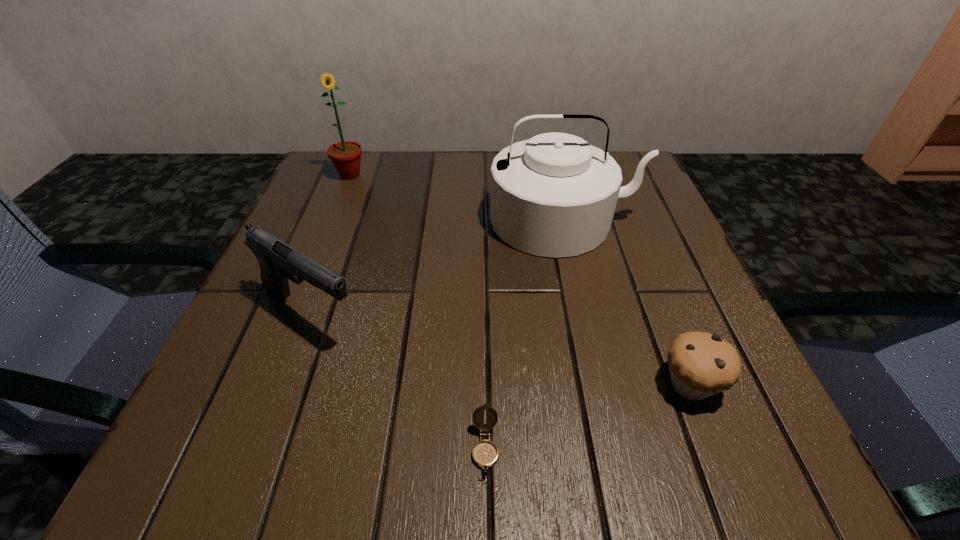
Locate an element on the screen. The image size is (960, 540). vacant space situated 0.170m at the muzzle of the third nearest object is located at coordinates coord(473,314).

Locate an element on the screen. The image size is (960, 540). vacant region located 0.150m on the left of the muffin is located at coordinates (553, 384).

You are a GUI agent. You are given a task and a screenshot of the screen. Output one action in this format:
    pyautogui.click(x=<x>, y=<y>)
    Task: Click on the sunflower present at the far edge
    This screenshot has height=540, width=960.
    Given the screenshot: What is the action you would take?
    (346, 155)

Where is `kettle at the far edge`? The image size is (960, 540). kettle at the far edge is located at coordinates (554, 195).

The width and height of the screenshot is (960, 540). In order to click on object that is at the near edge in this screenshot , I will do `click(485, 453)`.

I want to click on sunflower that is at the left edge, so click(x=346, y=155).

The image size is (960, 540). Identify the location of gun that is at the left edge. (278, 261).

Find the location of a particular element. This screenshot has height=540, width=960. kettle that is at the right edge is located at coordinates 554,195.

Where is `muffin positioned at the right edge`? muffin positioned at the right edge is located at coordinates (701, 364).

Where is `object positioned at the far left corner`? This screenshot has height=540, width=960. object positioned at the far left corner is located at coordinates (346, 155).